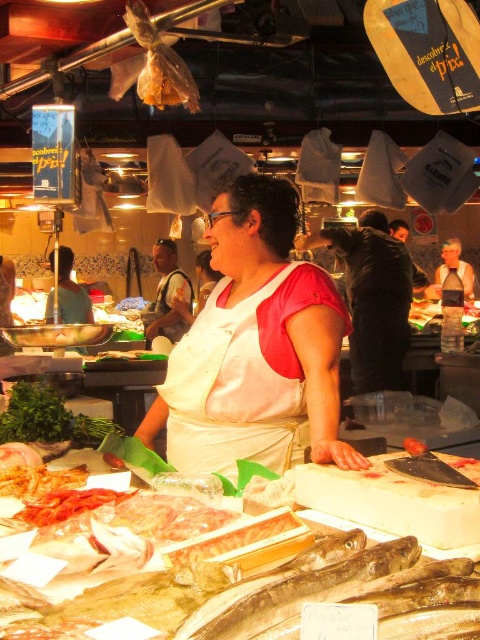
Which is more to the left, white matte apron at center or matte white apron at center?

Positioned to the left is white matte apron at center.

Is point (308, 342) closer to viewer compared to point (445, 262)?

Yes, point (308, 342) is closer to viewer.

Consider the image. Who is more forward, (276, 326) or (456, 248)?

Point (276, 326) is more forward.

You are a GUI agent. You are given a task and a screenshot of the screen. Output one action in this format:
    pyautogui.click(x=<x>, y=<y>)
    Task: Click on the white matte apron at center
    
    Given the screenshot: What is the action you would take?
    pyautogui.click(x=255, y=348)

In the scene shown: Measure the distance between white fabric apron at center and camera.

1.59 meters

Can you confirm if white fabric apron at center is positioned above matte white apron at center?

No, white fabric apron at center is not above matte white apron at center.

Does point (215, 339) come farther from viewer compared to point (464, 275)?

No.

The width and height of the screenshot is (480, 640). I want to click on white fabric apron at center, so click(239, 381).

Does white matte apron at center appear over shiny silver fish at center?

Correct, white matte apron at center is located above shiny silver fish at center.

Does point (267, 464) come farther from viewer compared to point (336, 557)?

Yes, point (267, 464) is behind point (336, 557).

I want to click on white matte apron at center, so click(x=255, y=348).